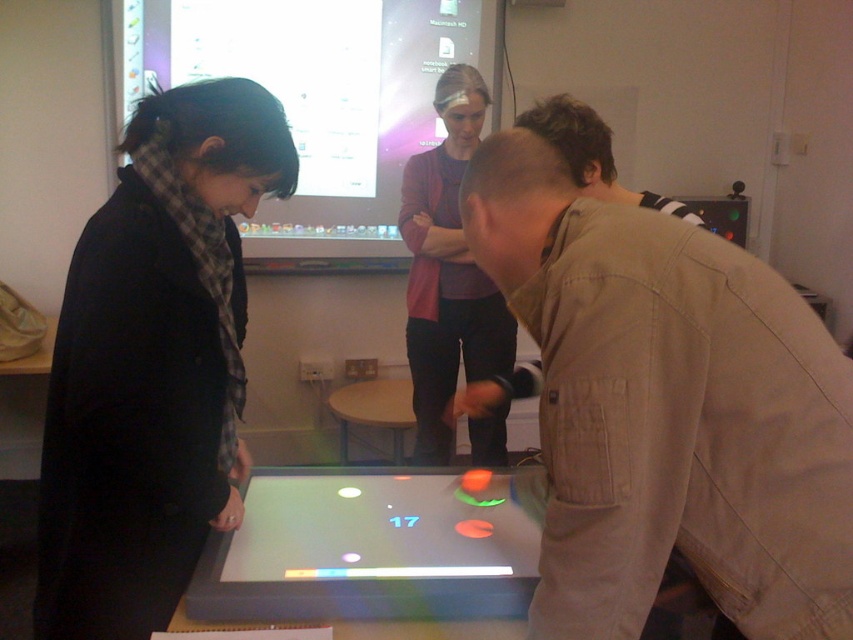
Question: Considering the relative positions of black woolen scarf at left and gray plastic table at center in the image provided, where is black woolen scarf at left located with respect to gray plastic table at center?

Choices:
 (A) left
 (B) right

Answer: (A)

Question: Does matte black screen at upper center have a larger size compared to translucent plastic table at center?

Choices:
 (A) yes
 (B) no

Answer: (A)

Question: Which object appears closest to the camera in this image?

Choices:
 (A) gray plastic table at center
 (B) translucent plastic table at center
 (C) matte black screen at upper center
 (D) black woolen scarf at left

Answer: (A)

Question: Which point appears farthest from the camera in this image?

Choices:
 (A) (331, 20)
 (B) (86, 561)
 (C) (461, 349)

Answer: (A)

Question: Is gray plastic table at center thinner than translucent plastic table at center?

Choices:
 (A) yes
 (B) no

Answer: (B)

Question: Which object is the farthest from the gray plastic table at center?

Choices:
 (A) black woolen scarf at left
 (B) matte pink sweater at center

Answer: (B)